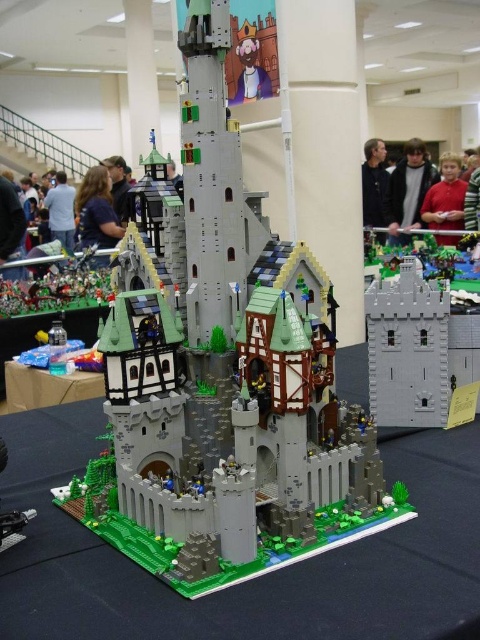
You are a photographer at the LEGO exhibition and need to capture a clear shot of both the black matte jacket at upper center and the blue shirt at center. However, you can only focus on one subject at a time. Which subject should you focus on to ensure the other remains in the background?

You should focus on the black matte jacket at upper center because it is positioned over the blue shirt at center, meaning the blue shirt at center will be in the background if the jacket is in focus.

You are a photographer at the LEGO exhibition. You want to capture a photo that includes both the blue shirt at center and the matte black hair at upper left. What is the minimum distance you need to maintain between the camera and the subjects to ensure both are in frame?

The blue shirt at center is 9.88 inches from matte black hair at upper left. To ensure both are in frame, the minimum distance should be at least 9.88 inches.

Looking at this image, you are a photographer at the LEGO exhibition and need to capture both the black matte jacket at upper center and the blue shirt at center in a single shot. Which clothing item will appear narrower in the photo?

The black matte jacket at upper center will appear narrower in the photo because it is thinner than the blue shirt at center.